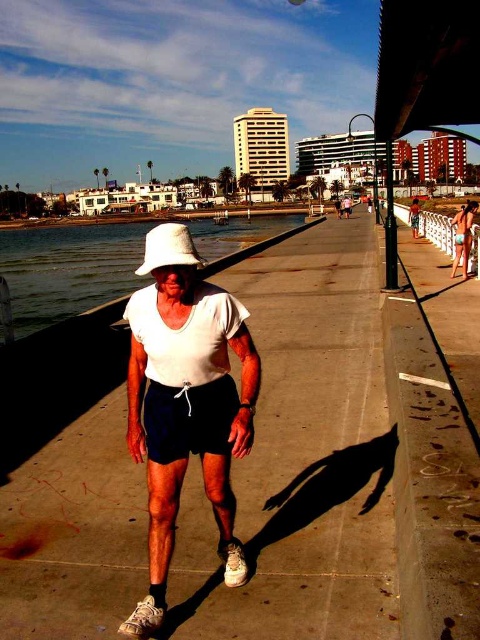
You are a photographer trying to capture the reflection of the black cotton shorts at center in the clear water at center. Based on their positions, do you think the reflection will be visible?

The clear water at center has a greater height compared to black cotton shorts at center. Since the water is higher than the shorts, the reflection of the black cotton shorts at center would not be visible in the clear water at center.

You are a photographer standing at the end of the promenade. You want to take a photo of the black cotton shorts at center and the white fabric cowboy hat at center so that both are in focus. Given that your camera has a depth of field that can cover objects within a 2 meter range, will you be able to capture both items clearly in the same shot?

The distance between the black cotton shorts at center and the white fabric cowboy hat at center is 2.08 meters. Since the camera can only cover 2 meters, the distance is slightly beyond the depth of field range. Therefore, it might be challenging to have both items in focus simultaneously in the same shot.

You are standing on the seaside promenade and see two points marked on the ground. The first point is at position point (127, 259) and the second is at point (156, 452). If you are facing the direction the person in white is walking, which point is closer to you?

Point (127, 259) is behind point (156, 452). Since you are facing the direction the person in white is walking, the point (156, 452) is closer to you because it is in front of the other point.